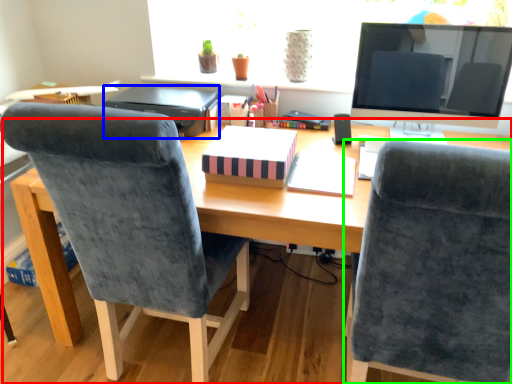
Question: Estimate the real-world distances between objects in this image. Which object is closer to desk (highlighted by a red box), printer (highlighted by a blue box) or chair (highlighted by a green box)?

Choices:
 (A) printer
 (B) chair

Answer: (B)